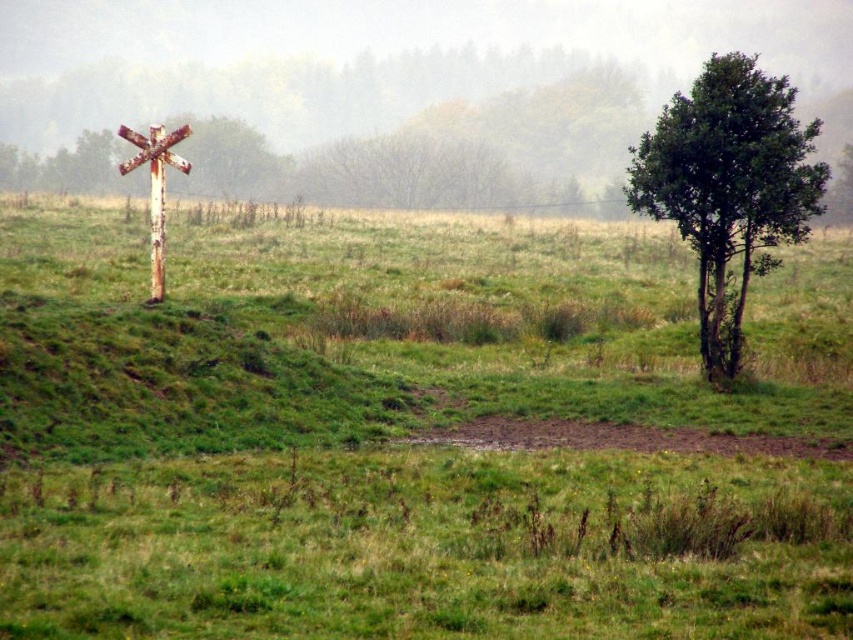
Question: From the image, what is the correct spatial relationship of green leafy tree at right in relation to rusty metal telegraph pole at left?

Choices:
 (A) below
 (B) above

Answer: (A)

Question: Does green grassy at left appear under rusty metal cross at left?

Choices:
 (A) yes
 (B) no

Answer: (A)

Question: Which point is closer to the camera taking this photo?

Choices:
 (A) (746, 122)
 (B) (155, 173)
 (C) (653, 628)
 (D) (161, 148)

Answer: (C)

Question: Can you confirm if rusty metal cross at left is positioned to the right of rusty metal telegraph pole at left?

Choices:
 (A) yes
 (B) no

Answer: (B)

Question: Considering the real-world distances, which object is closest to the green leafy tree at right?

Choices:
 (A) rusty metal telegraph pole at left
 (B) rusty metal cross at left

Answer: (A)

Question: Which point appears closest to the camera in this image?

Choices:
 (A) (271, 593)
 (B) (120, 163)
 (C) (155, 294)
 (D) (779, 182)

Answer: (A)